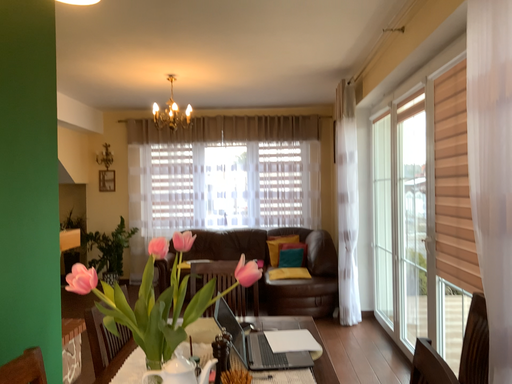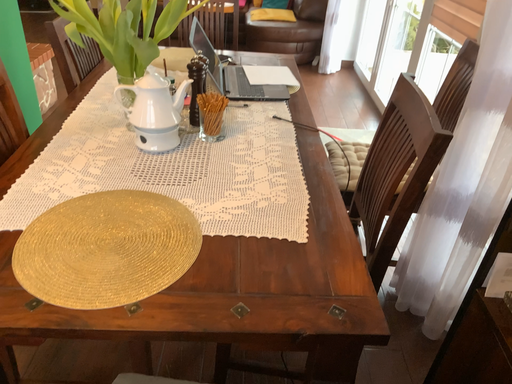
Question: Which way did the camera rotate in the video?

Choices:
 (A) rotated upward
 (B) rotated downward

Answer: (B)